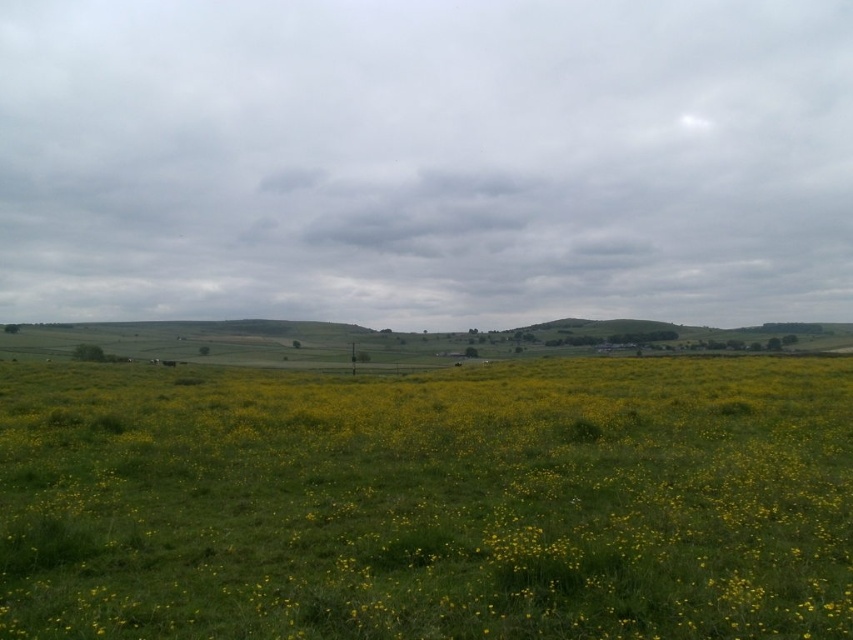
Does cloudy sky at center have a lesser width compared to yellow grass at center?

No, cloudy sky at center is not thinner than yellow grass at center.

Is point (450, 72) less distant than point (338, 397)?

No, it is not.

In order to click on cloudy sky at center in this screenshot , I will do `click(426, 161)`.